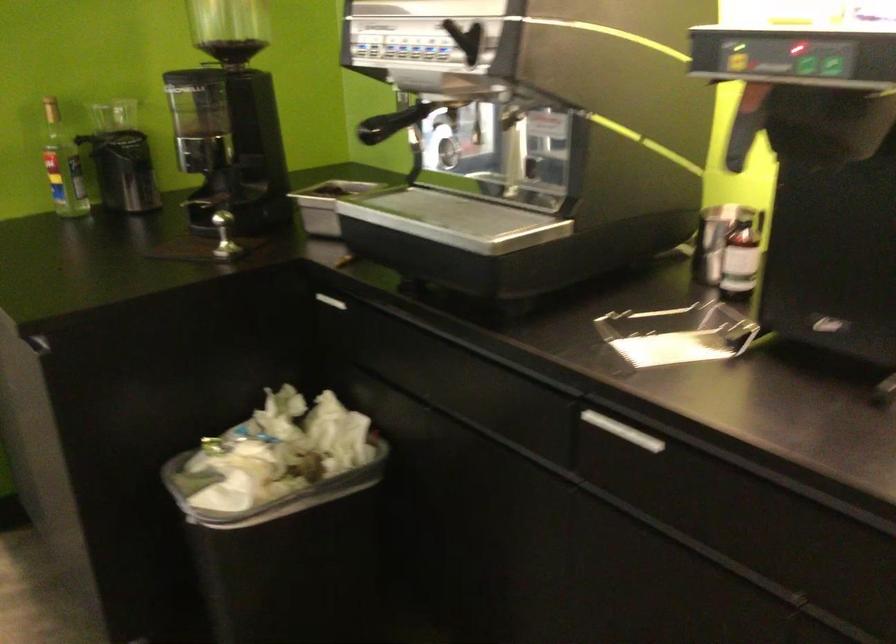
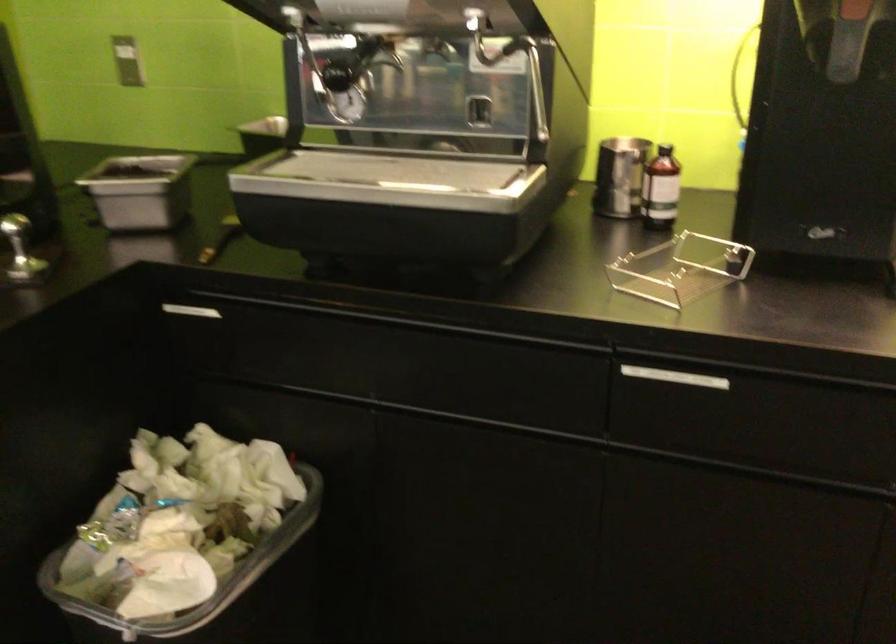
In the second image, find the point that corresponds to point (254, 507) in the first image.

(218, 592)